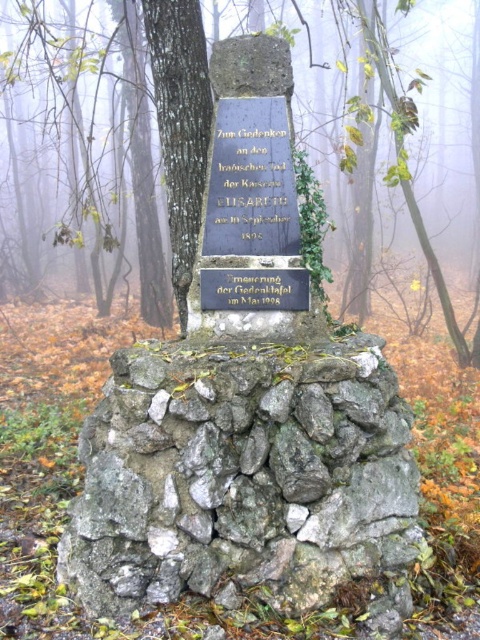
Question: Can you confirm if dark gray stone monument at center is wider than green leafy tree at center?

Choices:
 (A) yes
 (B) no

Answer: (B)

Question: Which point appears farthest from the camera in this image?

Choices:
 (A) (300, 74)
 (B) (294, 241)
 (C) (363, 348)
 (D) (207, 346)

Answer: (A)

Question: Can you confirm if gray rough stone at center is smaller than black stone plaque at center?

Choices:
 (A) yes
 (B) no

Answer: (B)

Question: Estimate the real-world distances between objects in this image. Which object is closer to the dark gray stone monument at center?

Choices:
 (A) gray rough stone at center
 (B) black stone plaque at center

Answer: (A)

Question: Which is farther from the dark gray stone monument at center?

Choices:
 (A) black stone plaque at center
 (B) green leafy tree at center

Answer: (B)

Question: Is dark gray stone monument at center smaller than green leafy tree at center?

Choices:
 (A) yes
 (B) no

Answer: (A)